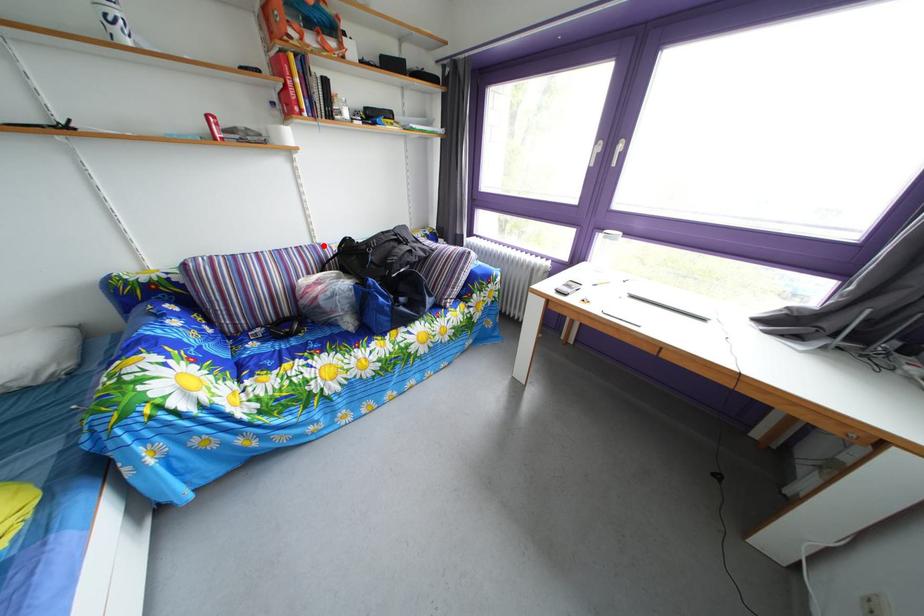
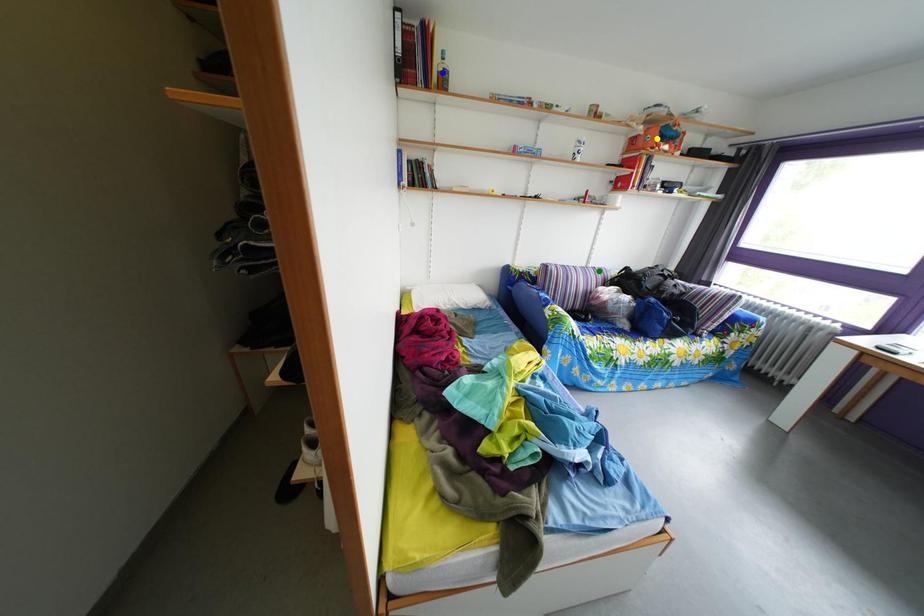
Question: I am providing you with two images of the same scene from different viewpoints. A red point is marked on the first image. You are given multiple points on the second image. Can you choose the point in image 2 that corresponds to the point in image 1?

Choices:
 (A) green point
 (B) yellow point
 (C) blue point

Answer: (A)